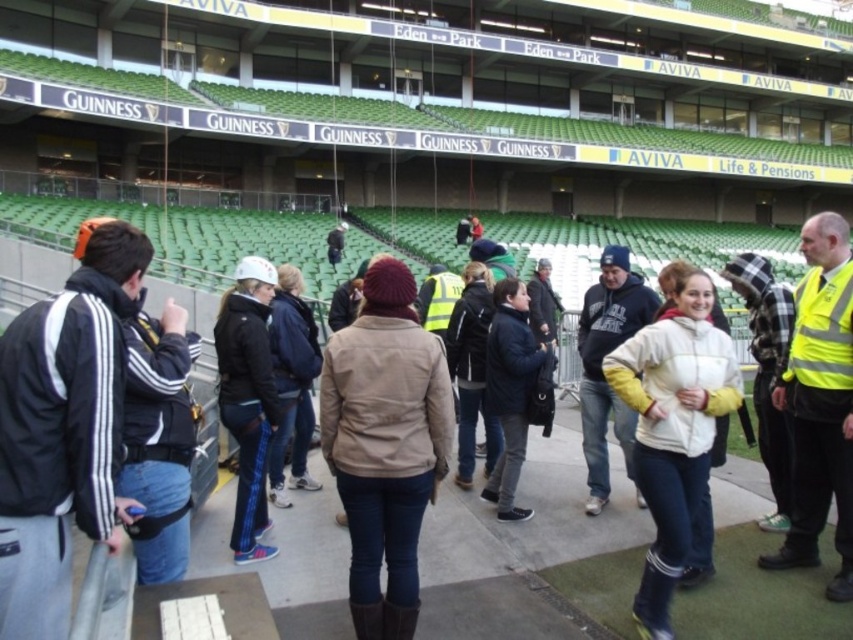
Question: Is matte black jacket at center smaller than dark blue jacket at center?

Choices:
 (A) no
 (B) yes

Answer: (B)

Question: Is white fleece jacket at center positioned before matte black jacket at center?

Choices:
 (A) yes
 (B) no

Answer: (A)

Question: Which object is positioned closest to the dark blue jacket at center?

Choices:
 (A) matte black jacket at center
 (B) beige fabric jacket at center
 (C) white fleece jacket at center

Answer: (C)

Question: Which point is farther from the camera taking this photo?

Choices:
 (A) (648, 381)
 (B) (244, 516)

Answer: (B)

Question: Which of the following is the farthest from the observer?

Choices:
 (A) [637, 445]
 (B) [370, 428]
 (C) [244, 561]

Answer: (C)

Question: In this image, where is white fleece jacket at center located relative to dark blue jacket at center?

Choices:
 (A) right
 (B) left

Answer: (A)